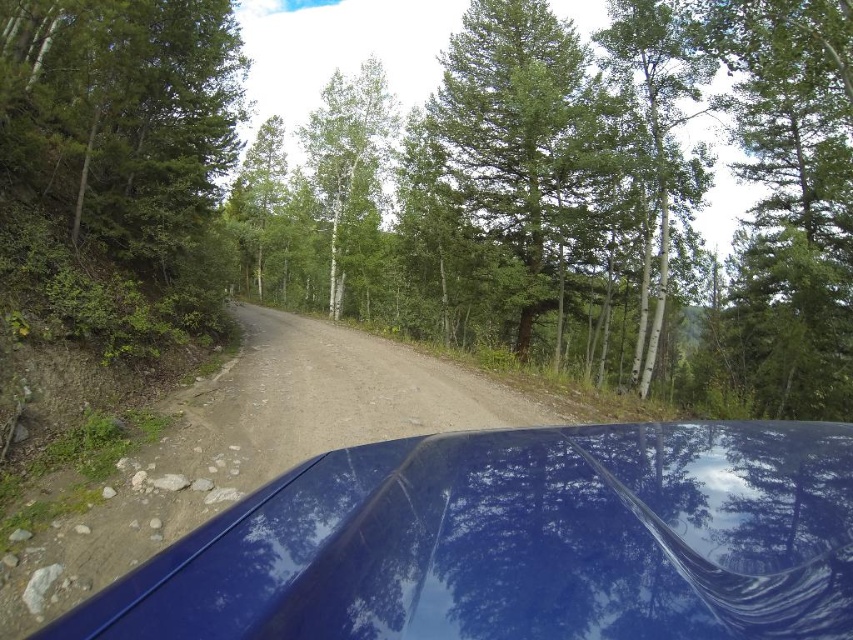
Question: Which point is farther to the camera?

Choices:
 (A) (178, 621)
 (B) (553, 412)

Answer: (B)

Question: Considering the relative positions of green matte tree at center and glossy blue car at center in the image provided, where is green matte tree at center located with respect to glossy blue car at center?

Choices:
 (A) above
 (B) below

Answer: (A)

Question: Can you confirm if green smooth bark tree at upper right is positioned to the left of white bark tree at center?

Choices:
 (A) no
 (B) yes

Answer: (A)

Question: Where is glossy blue car at center located in relation to white bark tree at center in the image?

Choices:
 (A) below
 (B) above

Answer: (A)

Question: Which object is positioned closest to the white bark tree at center?

Choices:
 (A) dirt/gravel road at center
 (B) glossy blue car at center
 (C) green smooth bark tree at upper right
 (D) green matte tree at center

Answer: (D)

Question: Which object appears farthest from the camera in this image?

Choices:
 (A) dirt/gravel road at center
 (B) green matte tree at center
 (C) glossy blue car at center

Answer: (B)